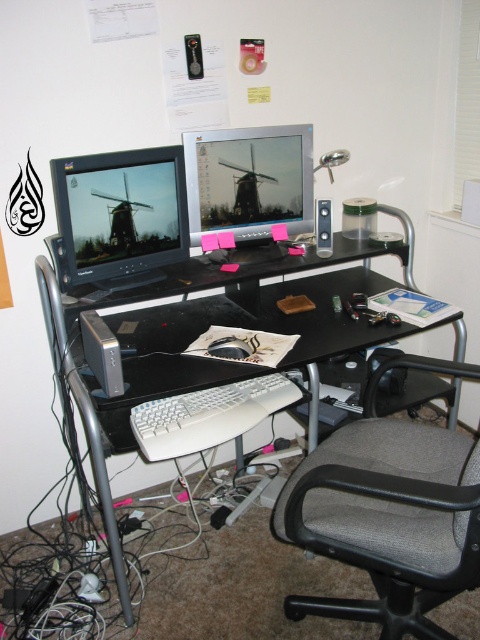
Does black plastic desk at center have a lesser width compared to white plastic keyboard at center?

No, black plastic desk at center is not thinner than white plastic keyboard at center.

Does black plastic desk at center appear over white plastic keyboard at center?

Yes.

Who is more distant from viewer, (177, 353) or (205, 403)?

Positioned behind is point (177, 353).

Locate an element on the screen. The width and height of the screenshot is (480, 640). black plastic desk at center is located at coordinates (128, 387).

This screenshot has width=480, height=640. Identify the location of matte black monitor at left. (120, 216).

At what (x,y) coordinates should I click in order to perform the action: click on matte black monitor at left. Please return your answer as a coordinate pair (x, y). This screenshot has width=480, height=640. Looking at the image, I should click on (120, 216).

Does gray fabric swivel chair at lower right appear on the left side of white plastic keyboard at center?

No, gray fabric swivel chair at lower right is not to the left of white plastic keyboard at center.

Which is more to the left, gray fabric swivel chair at lower right or white plastic keyboard at center?

From the viewer's perspective, white plastic keyboard at center appears more on the left side.

This screenshot has width=480, height=640. I want to click on gray fabric swivel chair at lower right, so click(x=387, y=518).